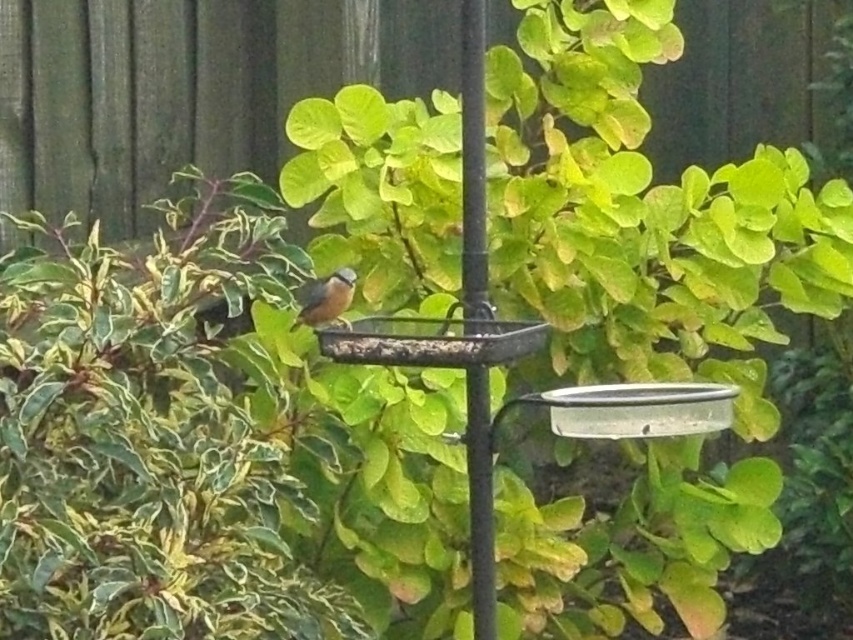
You are a gardener who wants to place a new plant in the garden. The coordinates of the green leafy bush at center are given. Where should you place the new plant to avoid blocking the bird feeder?

The green leafy bush at center is located at coordinates point (653,227). To avoid blocking the bird feeder, place the new plant away from this position, ensuring it doesn not obstruct the feeder area.

You are standing in the garden and want to hang a new bird feeder. The existing bird feeder is mounted on the black metal pole at center. To avoid blocking sunlight to the green leafy bush at center, should you place the new feeder above or below the current one?

The green leafy bush at center is above the black metal pole at center, so placing the new feeder below the current one would avoid blocking sunlight to the bush.

You are standing at a point 3.26 meters away from the bird feeder. If you want to place a small birdhouse exactly at the point marked as point (500, 108), which is 3.26 meters away from you, will it be placed in the same location as the bird feeder?

The point marked as point (500, 108) is 3.26 meters away from you, so placing the birdhouse there will position it at the same location as the bird feeder since the distance matches.